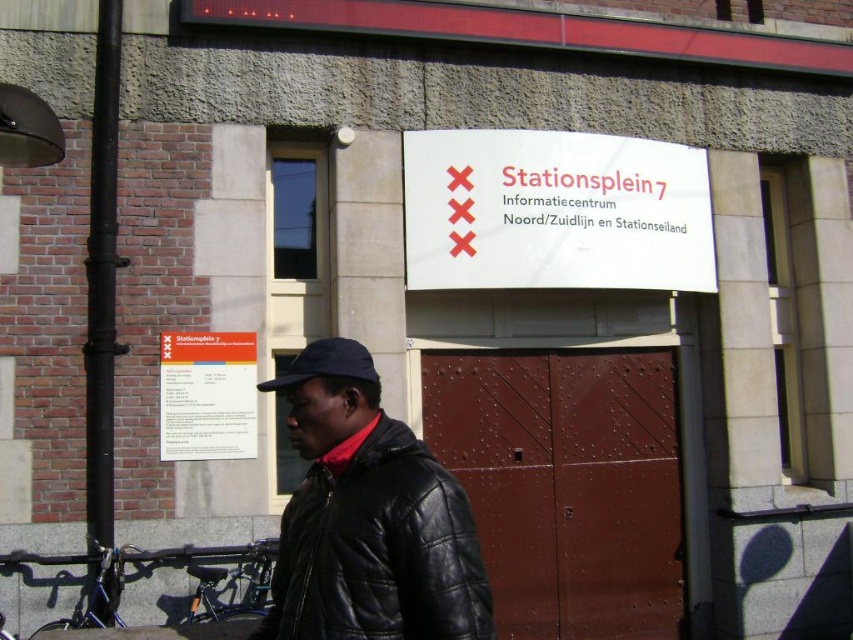
You are standing in front of the building shown in the image. You want to read the white paper sign at center. Can you read the text on the sign without moving closer? Please explain your reasoning.

The white paper sign at center is 6.09 meters away from the viewer. Since this distance is quite far, it might be difficult to read the text clearly without moving closer to the sign.

You are a delivery person who needs to read the information on the white paper sign at center and the matte blue cap at center. Which object should you look at first if you want to read the text clearly?

The white paper sign at center has a larger size compared to the matte blue cap at center, so you should look at the white paper sign at center first to read the text clearly.